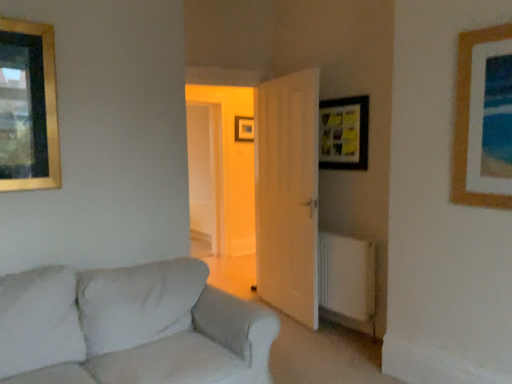
Where is `wooden picture frame at upper right, which appears as the first picture frame when viewed from the right`? This screenshot has height=384, width=512. wooden picture frame at upper right, which appears as the first picture frame when viewed from the right is located at coordinates (468, 119).

At what (x,y) coordinates should I click in order to perform the action: click on gold-framed picture at upper left, which is the third picture frame from back to front. Please return your answer as a coordinate pair (x, y). This screenshot has width=512, height=384. Looking at the image, I should click on (28, 107).

Where is `white fabric couch at lower left`? white fabric couch at lower left is located at coordinates (130, 327).

This screenshot has width=512, height=384. Describe the element at coordinates (244, 129) in the screenshot. I see `wooden picture frame at center, the 1th picture frame when ordered from back to front` at that location.

What is the approximate height of white wooden door at center?

The height of white wooden door at center is 2.02 meters.

Where is `transparent glass door at center`? This screenshot has height=384, width=512. transparent glass door at center is located at coordinates (205, 173).

This screenshot has height=384, width=512. In order to click on wooden picture frame at upper right, acting as the 4th picture frame starting from the left in this screenshot , I will do `click(468, 119)`.

Would you say white wooden door at center is outside white plastic radiator at lower right?

Absolutely, white wooden door at center is external to white plastic radiator at lower right.

The height and width of the screenshot is (384, 512). I want to click on door lying behind the white plastic radiator at lower right, so click(x=288, y=194).

Is white wooden door at center with white plastic radiator at lower right?

No, white wooden door at center is not in contact with white plastic radiator at lower right.

Image resolution: width=512 pixels, height=384 pixels. I want to click on glass door above the white fabric couch at lower left (from the image's perspective), so click(205, 173).

From the image's perspective, is white fabric couch at lower left under transparent glass door at center?

Correct, white fabric couch at lower left appears lower than transparent glass door at center in the image.

From a real-world perspective, is white fabric couch at lower left under transparent glass door at center?

Correct, in the physical world, white fabric couch at lower left is lower than transparent glass door at center.

Is wooden picture frame at upper right, acting as the 4th picture frame starting from the left, facing towards white wooden door at center?

No, wooden picture frame at upper right, acting as the 4th picture frame starting from the left, is not turned towards white wooden door at center.

Considering the sizes of wooden picture frame at upper right, acting as the 4th picture frame starting from the left, and white wooden door at center in the image, is wooden picture frame at upper right, acting as the 4th picture frame starting from the left, wider or thinner than white wooden door at center?

In the image, wooden picture frame at upper right, acting as the 4th picture frame starting from the left, appears to be more narrow than white wooden door at center.

From the image's perspective, is wooden picture frame at upper right, acting as the 4th picture frame starting from the left, below white wooden door at center?

No.

Can you confirm if transparent glass door at center is smaller than white plastic radiator at lower right?

Incorrect, transparent glass door at center is not smaller in size than white plastic radiator at lower right.

The width and height of the screenshot is (512, 384). What are the coordinates of `radiator that is on the right side of transparent glass door at center` in the screenshot? It's located at (347, 281).

Is transparent glass door at center facing away from white plastic radiator at lower right?

No.

Is transparent glass door at center in contact with white plastic radiator at lower right?

No, transparent glass door at center is not touching white plastic radiator at lower right.

Could you tell me if transparent glass door at center is turned towards white wooden door at center?

Yes, transparent glass door at center is facing white wooden door at center.

From the picture: Choose the correct answer: Is transparent glass door at center inside white wooden door at center or outside it?

transparent glass door at center is located beyond the bounds of white wooden door at center.

From a real-world perspective, which is physically below, transparent glass door at center or white wooden door at center?

From a 3D spatial view, white wooden door at center is below.

Which is more to the left, transparent glass door at center or white wooden door at center?

Positioned to the left is transparent glass door at center.

Which is closer to the camera, [36,51] or [348,117]?

The point [36,51] is more forward.

Consider the image. From a real-world perspective, is gold-framed picture at upper left, the 4th picture frame in the right-to-left sequence, positioned above or below wooden matte picture frame at upper right, which is counted as the second picture frame, starting from the back?

Clearly, from a real-world perspective, gold-framed picture at upper left, the 4th picture frame in the right-to-left sequence, is above wooden matte picture frame at upper right, which is counted as the second picture frame, starting from the back.

Can you tell me how much gold-framed picture at upper left, positioned as the first picture frame in left-to-right order, and wooden matte picture frame at upper right, the 3th picture frame in the front-to-back sequence, differ in facing direction?

89.3 degrees.

Considering the sizes of gold-framed picture at upper left, positioned as the first picture frame in left-to-right order, and wooden matte picture frame at upper right, the third picture frame when ordered from left to right, in the image, is gold-framed picture at upper left, positioned as the first picture frame in left-to-right order, wider or thinner than wooden matte picture frame at upper right, the third picture frame when ordered from left to right,?

gold-framed picture at upper left, positioned as the first picture frame in left-to-right order, is wider than wooden matte picture frame at upper right, the third picture frame when ordered from left to right.

Considering the relative positions of wooden picture frame at upper right, which appears as the first picture frame when viewed from the right, and wooden matte picture frame at upper right, acting as the 2th picture frame starting from the right, in the image provided, is wooden picture frame at upper right, which appears as the first picture frame when viewed from the right, to the left of wooden matte picture frame at upper right, acting as the 2th picture frame starting from the right, from the viewer's perspective?

In fact, wooden picture frame at upper right, which appears as the first picture frame when viewed from the right, is to the right of wooden matte picture frame at upper right, acting as the 2th picture frame starting from the right.

Based on the photo, considering the relative sizes of wooden picture frame at upper right, marked as the first picture frame in a front-to-back arrangement, and wooden matte picture frame at upper right, acting as the 2th picture frame starting from the right, in the image provided, is wooden picture frame at upper right, marked as the first picture frame in a front-to-back arrangement, taller than wooden matte picture frame at upper right, acting as the 2th picture frame starting from the right,?

Yes.

Relative to wooden matte picture frame at upper right, the third picture frame when ordered from left to right, is wooden picture frame at upper right, marked as the first picture frame in a front-to-back arrangement, in front or behind?

In the image, wooden picture frame at upper right, marked as the first picture frame in a front-to-back arrangement, appears in front of wooden matte picture frame at upper right, the third picture frame when ordered from left to right.

Is wooden picture frame at upper right, which appears as the first picture frame when viewed from the right, looking in the opposite direction of wooden matte picture frame at upper right, acting as the 2th picture frame starting from the right?

No, wooden picture frame at upper right, which appears as the first picture frame when viewed from the right,'s orientation is not away from wooden matte picture frame at upper right, acting as the 2th picture frame starting from the right.

In the image, there is a white plastic radiator at lower right. Where is `door above it (from the image's perspective)`? This screenshot has width=512, height=384. door above it (from the image's perspective) is located at coordinates (288, 194).

You are a GUI agent. You are given a task and a screenshot of the screen. Output one action in this format:
    pyautogui.click(x=<x>, y=<y>)
    Task: Click on the studio couch that is on the right side of transparent glass door at center
    
    Given the screenshot: What is the action you would take?
    pyautogui.click(x=130, y=327)

Considering their positions, is wooden picture frame at center, the 1th picture frame when ordered from back to front, positioned further to transparent glass door at center than gold-framed picture at upper left, positioned as the first picture frame in left-to-right order?

gold-framed picture at upper left, positioned as the first picture frame in left-to-right order, is positioned further to the anchor transparent glass door at center.

Considering their positions, is transparent glass door at center positioned further to gold-framed picture at upper left, which is the third picture frame from back to front, than wooden picture frame at upper right, marked as the first picture frame in a front-to-back arrangement?

The object further to gold-framed picture at upper left, which is the third picture frame from back to front, is transparent glass door at center.

Looking at the image, which one is located further to white plastic radiator at lower right, white wooden door at center or wooden picture frame at center, the 1th picture frame when ordered from back to front?

The object further to white plastic radiator at lower right is wooden picture frame at center, the 1th picture frame when ordered from back to front.

Consider the image. Looking at the image, which one is located closer to wooden matte picture frame at upper right, the third picture frame when ordered from left to right, white plastic radiator at lower right or wooden picture frame at center, the 1th picture frame when ordered from back to front?

white plastic radiator at lower right is closer to wooden matte picture frame at upper right, the third picture frame when ordered from left to right.

Considering their positions, is white plastic radiator at lower right positioned closer to transparent glass door at center than wooden picture frame at center, the 1th picture frame when ordered from back to front?

wooden picture frame at center, the 1th picture frame when ordered from back to front, lies closer to transparent glass door at center than the other object.

Based on their spatial positions, is wooden matte picture frame at upper right, which is counted as the second picture frame, starting from the back, or gold-framed picture at upper left, which is the third picture frame from back to front, closer to white wooden door at center?

Based on the image, wooden matte picture frame at upper right, which is counted as the second picture frame, starting from the back, appears to be nearer to white wooden door at center.

When comparing their distances from white plastic radiator at lower right, does gold-framed picture at upper left, which is the third picture frame from back to front, or wooden matte picture frame at upper right, which is counted as the second picture frame, starting from the back, seem further?

gold-framed picture at upper left, which is the third picture frame from back to front, is further to white plastic radiator at lower right.

Which object lies further to the anchor point gold-framed picture at upper left, which is the third picture frame from back to front, wooden picture frame at upper right, which appears as the first picture frame when viewed from the right, or wooden matte picture frame at upper right, the 3th picture frame in the front-to-back sequence?

wooden picture frame at upper right, which appears as the first picture frame when viewed from the right, lies further to gold-framed picture at upper left, which is the third picture frame from back to front, than the other object.

The image size is (512, 384). I want to click on radiator between white fabric couch at lower left and transparent glass door at center from front to back, so click(x=347, y=281).

Where is `door between wooden picture frame at upper right, acting as the 4th picture frame starting from the left, and transparent glass door at center from front to back`? The width and height of the screenshot is (512, 384). door between wooden picture frame at upper right, acting as the 4th picture frame starting from the left, and transparent glass door at center from front to back is located at coordinates (288, 194).

This screenshot has width=512, height=384. What are the coordinates of `picture frame positioned between white plastic radiator at lower right and wooden picture frame at center, which ranks as the third picture frame in right-to-left order, from near to far` in the screenshot? It's located at (344, 133).

This screenshot has height=384, width=512. I want to click on glass door between wooden picture frame at upper right, marked as the first picture frame in a front-to-back arrangement, and wooden picture frame at center, which ranks as the third picture frame in right-to-left order, in the front-back direction, so click(x=205, y=173).